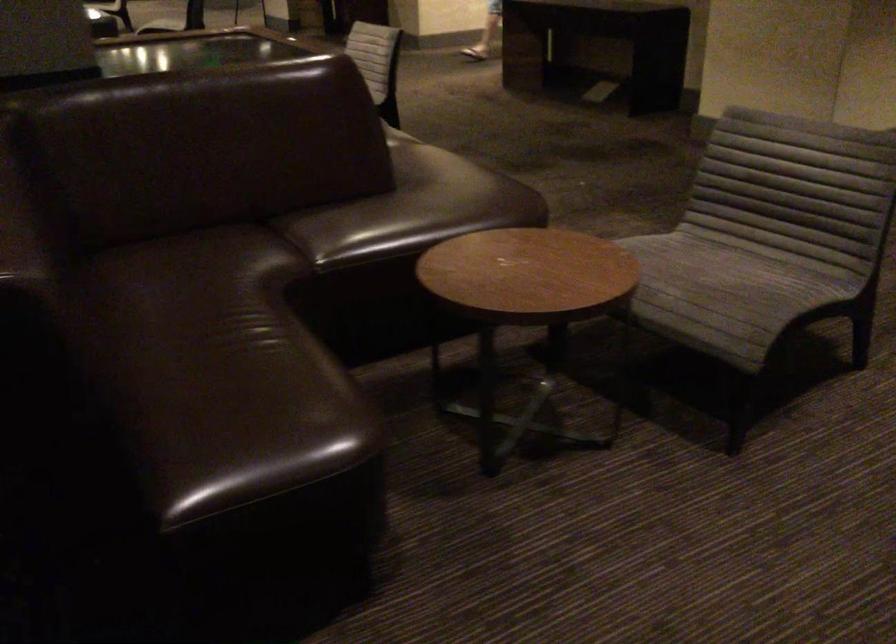
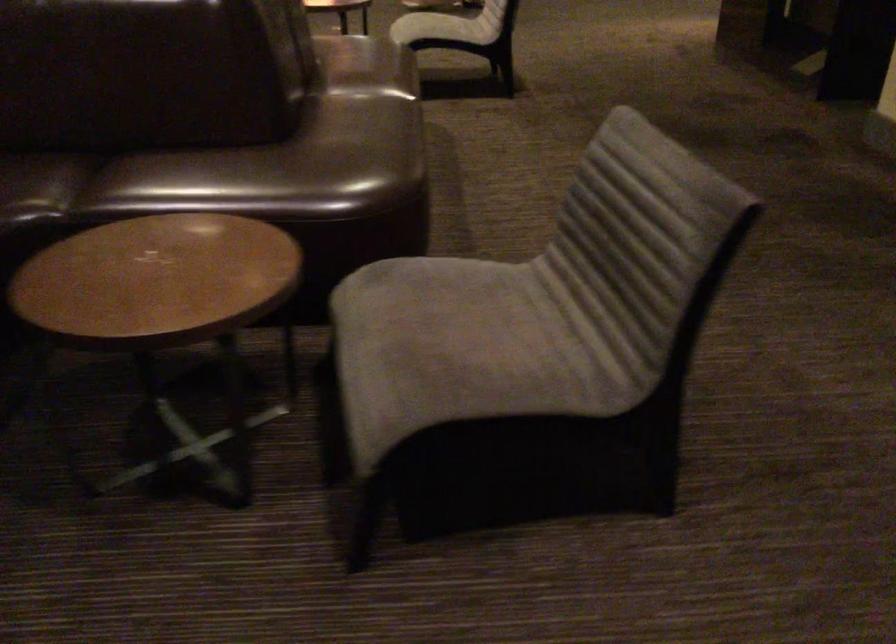
In a continuous first-person perspective shot, in which direction is the camera moving?

The movement direction of the cameraman is right, forward.